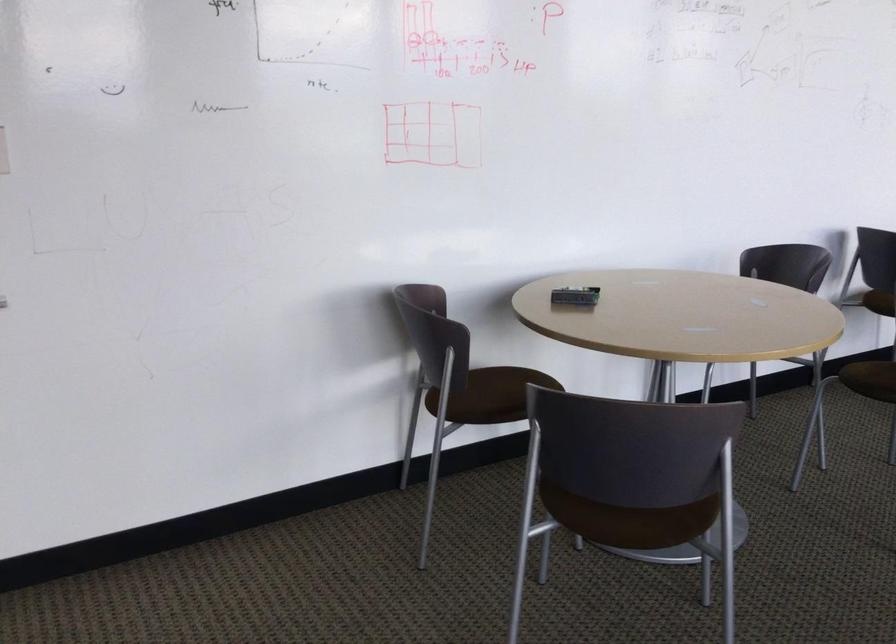
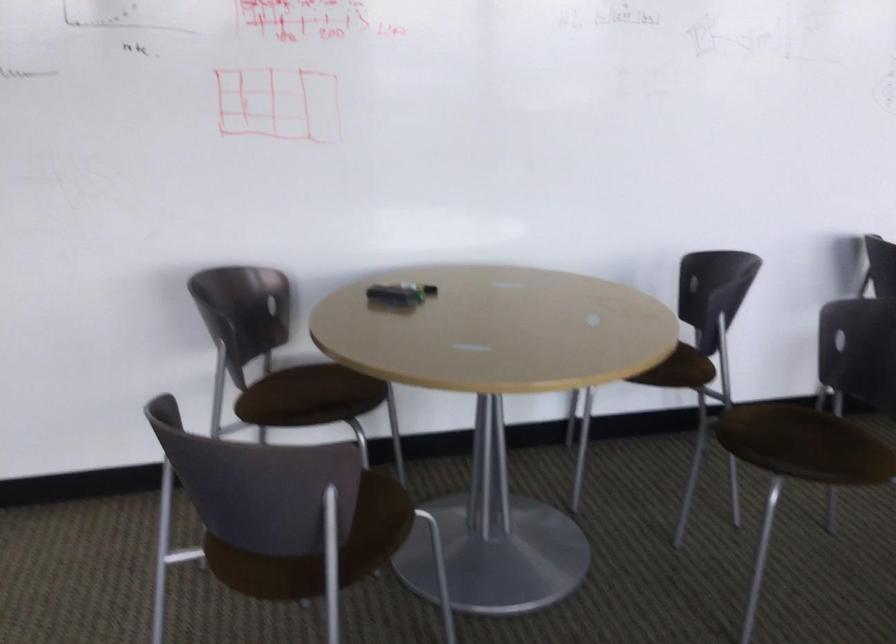
In the second image, find the point that corresponds to [619,533] in the first image.

(261, 570)